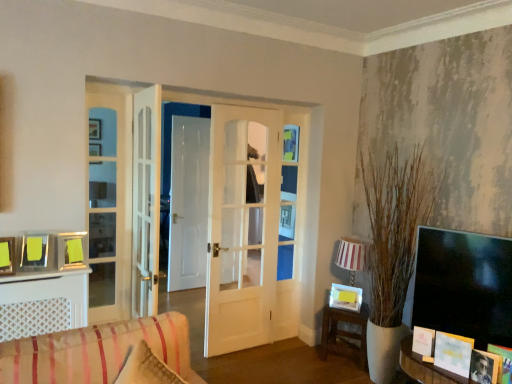
Image resolution: width=512 pixels, height=384 pixels. What are the coordinates of `free space to the left of wooden table at lower right` in the screenshot? It's located at (303, 359).